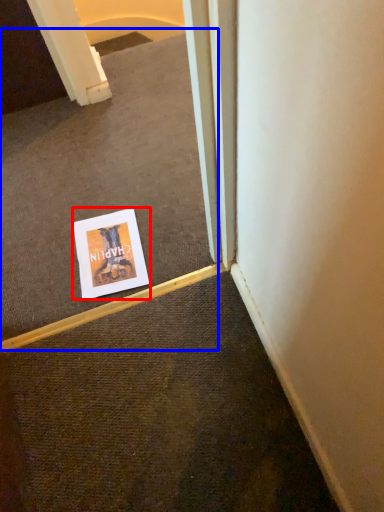
Question: Which object is further to the camera taking this photo, poster (highlighted by a red box) or escalator (highlighted by a blue box)?

Choices:
 (A) poster
 (B) escalator

Answer: (A)